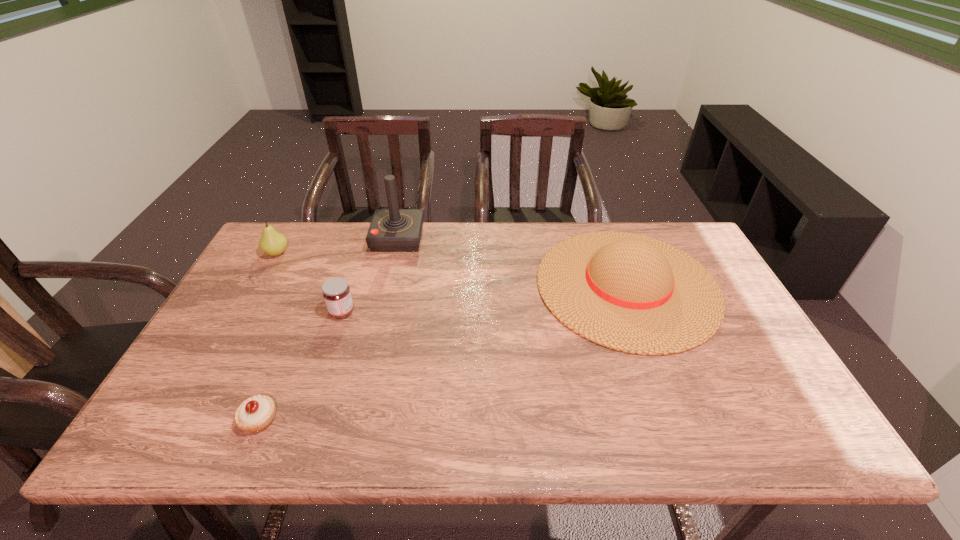
At what (x,y) coordinates should I click in order to perform the action: click on free space located on the front of the jam. Please return your answer as a coordinate pair (x, y). Image resolution: width=960 pixels, height=540 pixels. Looking at the image, I should click on (300, 439).

Locate an element on the screen. The image size is (960, 540). blank area located 0.150m on the left of the second object from left to right is located at coordinates tap(172, 419).

Locate an element on the screen. joystick at the far edge is located at coordinates (391, 230).

This screenshot has width=960, height=540. In order to click on bonnet at the far edge in this screenshot , I will do click(631, 293).

This screenshot has height=540, width=960. Find the location of `pear at the far edge`. pear at the far edge is located at coordinates (273, 243).

The image size is (960, 540). In order to click on object present at the near edge in this screenshot , I will do `click(254, 414)`.

Find the location of a particular element. This screenshot has height=540, width=960. object at the left edge is located at coordinates (273, 243).

In order to click on object present at the right edge in this screenshot , I will do `click(631, 293)`.

Where is `object that is at the far left corner`? Image resolution: width=960 pixels, height=540 pixels. object that is at the far left corner is located at coordinates (273, 243).

Where is `object at the far right corner`? The image size is (960, 540). object at the far right corner is located at coordinates (631, 293).